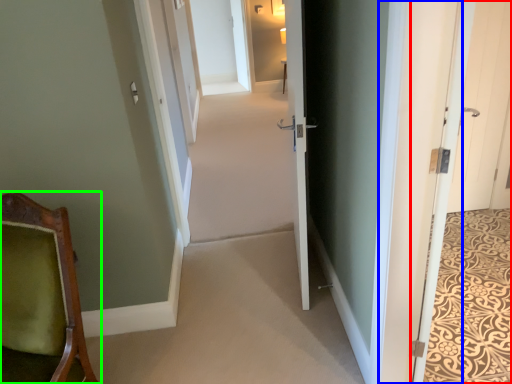
Question: Based on their relative distances, which object is nearer to door (highlighted by a red box)? Choose from door (highlighted by a blue box) and chair (highlighted by a green box).

Choices:
 (A) door
 (B) chair

Answer: (A)